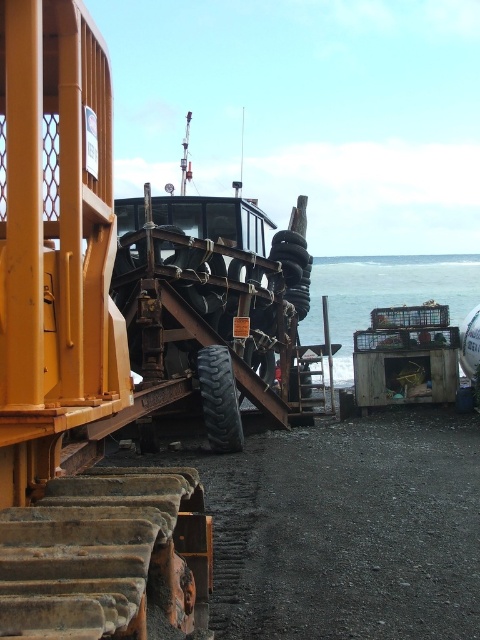
Is blue water at lower right bigger than black rubber tire at center?

Indeed, blue water at lower right has a larger size compared to black rubber tire at center.

Does point (384, 276) come farther from viewer compared to point (225, 369)?

Yes, it is behind point (225, 369).

Identify the location of blue water at lower right. (384, 292).

Find the location of a particular element. The width and height of the screenshot is (480, 640). blue water at lower right is located at coordinates (384, 292).